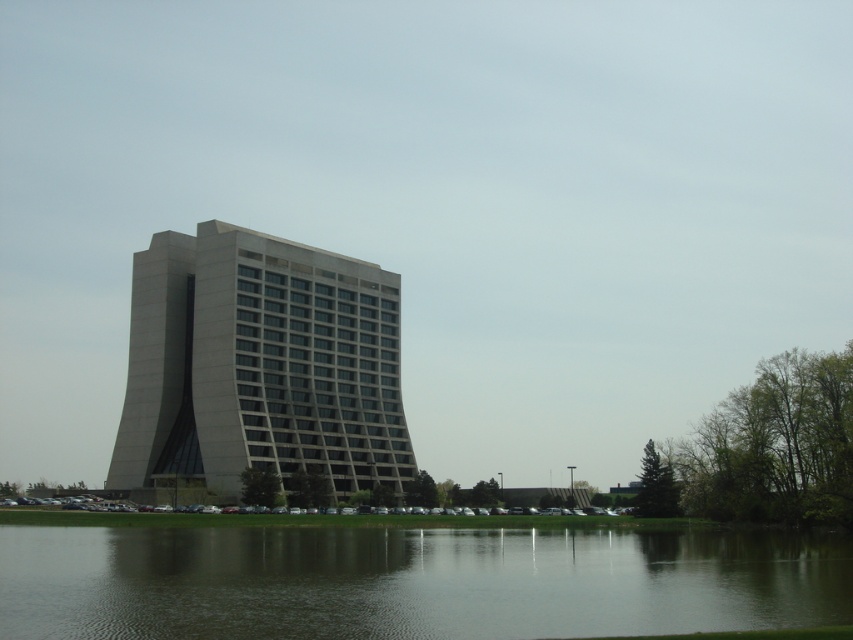
Question: Which point appears closest to the camera in this image?

Choices:
 (A) (140, 257)
 (B) (672, 602)

Answer: (B)

Question: Among these objects, which one is nearest to the camera?

Choices:
 (A) gray concrete building at center
 (B) dark green water at lower center

Answer: (B)

Question: Is dark green water at lower center wider than gray concrete building at center?

Choices:
 (A) yes
 (B) no

Answer: (A)

Question: Is the position of dark green water at lower center less distant than that of gray concrete building at center?

Choices:
 (A) yes
 (B) no

Answer: (A)

Question: Is dark green water at lower center to the right of gray concrete building at center from the viewer's perspective?

Choices:
 (A) no
 (B) yes

Answer: (B)

Question: Among these objects, which one is farthest from the camera?

Choices:
 (A) gray concrete building at center
 (B) dark green water at lower center

Answer: (A)